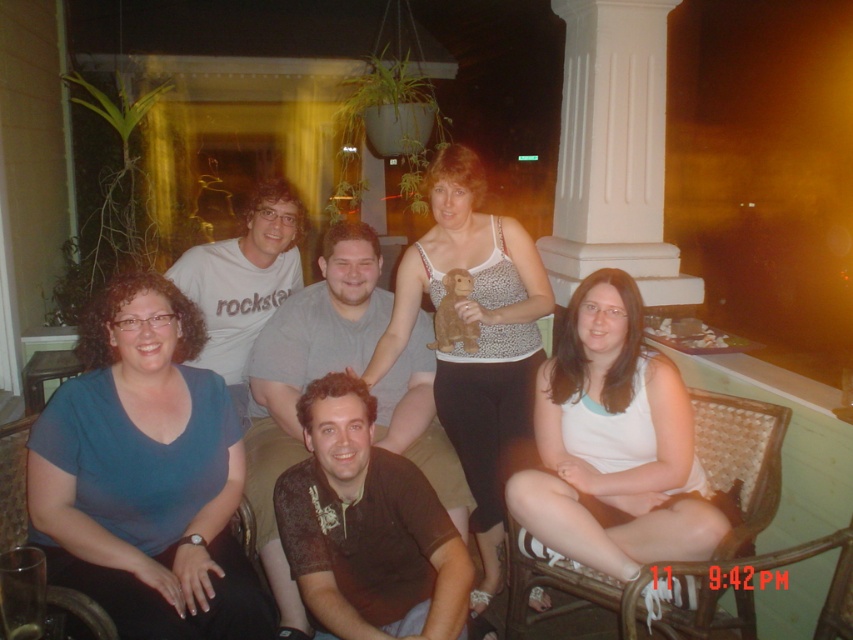
Does dark brown cotton shirt at center have a lesser height compared to woven wicker chair at lower right?

In fact, dark brown cotton shirt at center may be taller than woven wicker chair at lower right.

The width and height of the screenshot is (853, 640). What do you see at coordinates (306, 372) in the screenshot? I see `dark brown cotton shirt at center` at bounding box center [306, 372].

Find the location of `dark brown cotton shirt at center`. dark brown cotton shirt at center is located at coordinates pyautogui.click(x=306, y=372).

Is leopard print tank top at center thinner than white smooth column at upper center?

Yes, leopard print tank top at center is thinner than white smooth column at upper center.

Consider the image. Is leopard print tank top at center closer to the viewer compared to white smooth column at upper center?

Yes, it is in front of white smooth column at upper center.

Who is more forward, (457, 179) or (576, 160)?

Point (457, 179) is more forward.

Locate an element on the screen. This screenshot has width=853, height=640. leopard print tank top at center is located at coordinates (477, 340).

Which of these two, white smooth column at upper center or matte gray t-shirt at center, stands shorter?

Standing shorter between the two is matte gray t-shirt at center.

Is white smooth column at upper center positioned before matte gray t-shirt at center?

No.

This screenshot has height=640, width=853. In order to click on white smooth column at upper center in this screenshot , I will do pos(613,150).

The width and height of the screenshot is (853, 640). What are the coordinates of `white smooth column at upper center` in the screenshot? It's located at (613, 150).